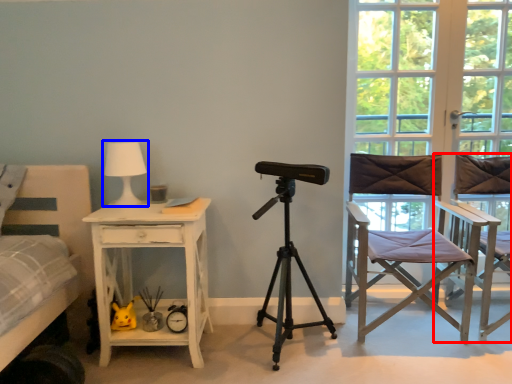
Question: Among these objects, which one is farthest to the camera, chair (highlighted by a red box) or table lamp (highlighted by a blue box)?

Choices:
 (A) chair
 (B) table lamp

Answer: (B)